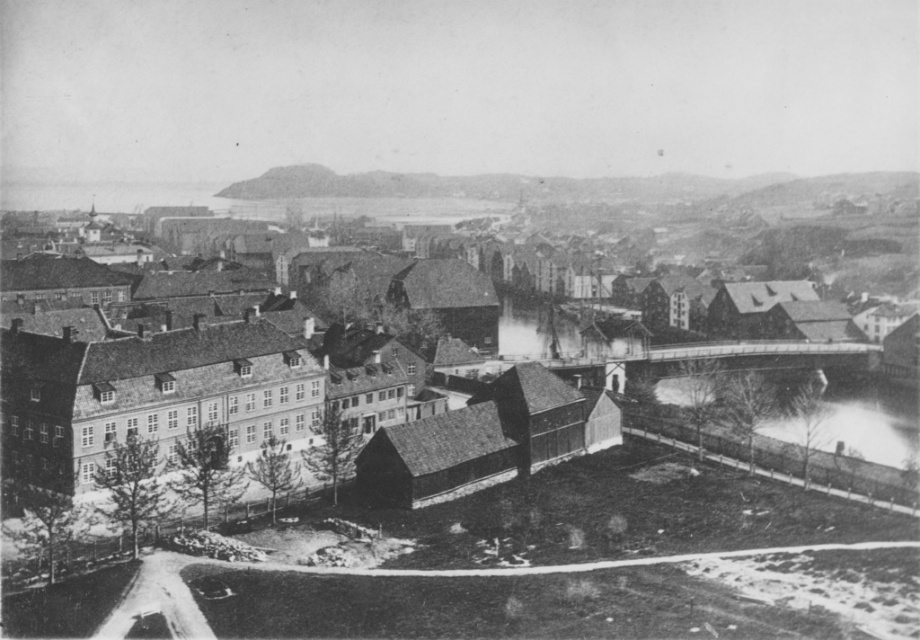
Question: Which point is farther to the camera?

Choices:
 (A) (789, 440)
 (B) (875, 442)

Answer: (B)

Question: Which point is farther from the camera taking this photo?

Choices:
 (A) 303,323
 (B) 828,390

Answer: (B)

Question: Where is wooden house at center located in relation to white frothy water at lower right in the image?

Choices:
 (A) above
 (B) below

Answer: (A)

Question: Can you confirm if wooden house at center is smaller than white frothy water at lower right?

Choices:
 (A) no
 (B) yes

Answer: (A)

Question: Does wooden house at center lie in front of white frothy water at lower right?

Choices:
 (A) yes
 (B) no

Answer: (A)